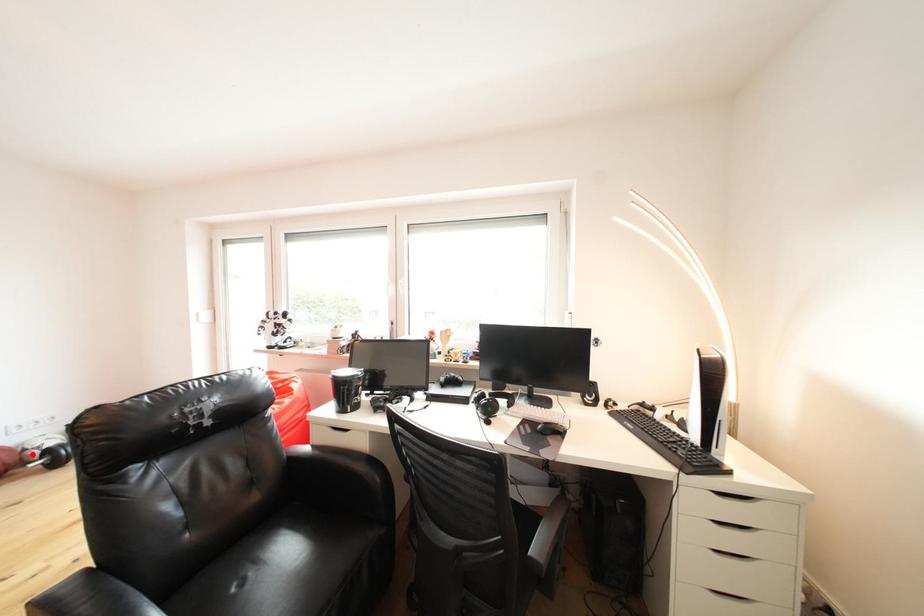
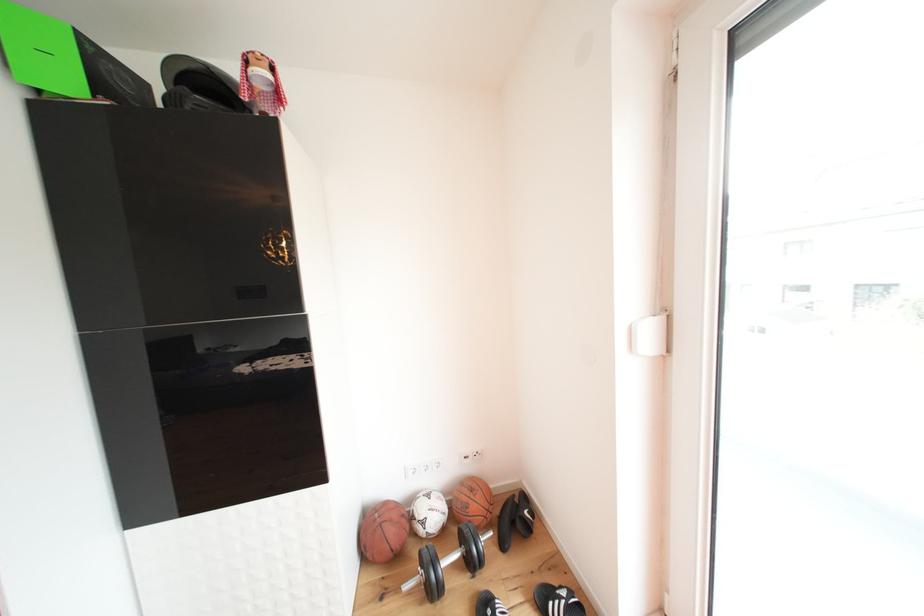
Question: I am providing you with two images of the same scene from different viewpoints. Image1 has a red point marked. In image2, the corresponding 3D location appears at what relative position? Reply with the corresponding letter.

Choices:
 (A) Closer
 (B) Farther

Answer: (B)